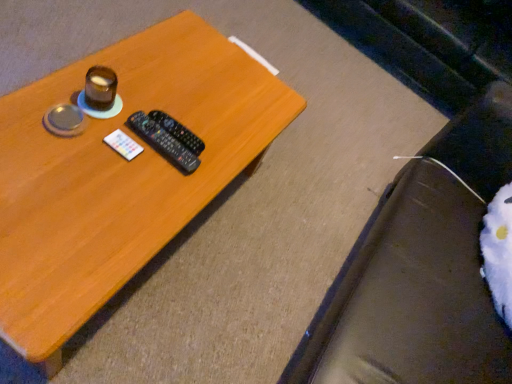
Image resolution: width=512 pixels, height=384 pixels. What are the coordinates of `free space to the back side of black plastic remote control at center, the 1th remote control viewed from the back` in the screenshot? It's located at (198, 101).